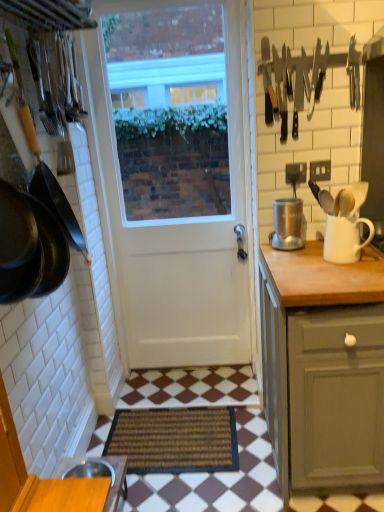
Question: Considering the relative positions of wooden table at lower left and silver metallic coffee grinder at right in the image provided, is wooden table at lower left to the right of silver metallic coffee grinder at right from the viewer's perspective?

Choices:
 (A) no
 (B) yes

Answer: (A)

Question: Would you say silver metallic coffee grinder at right is part of wooden table at lower left's contents?

Choices:
 (A) no
 (B) yes

Answer: (A)

Question: Considering the relative sizes of wooden table at lower left and silver metallic coffee grinder at right in the image provided, is wooden table at lower left wider than silver metallic coffee grinder at right?

Choices:
 (A) no
 (B) yes

Answer: (B)

Question: Is wooden table at lower left bigger than silver metallic coffee grinder at right?

Choices:
 (A) no
 (B) yes

Answer: (B)

Question: Does wooden table at lower left have a greater height compared to silver metallic coffee grinder at right?

Choices:
 (A) no
 (B) yes

Answer: (A)

Question: Is point (274, 204) positioned closer to the camera than point (342, 224)?

Choices:
 (A) closer
 (B) farther

Answer: (B)

Question: Considering the positions of silver metallic coffee grinder at right and white glossy jug at right in the image, is silver metallic coffee grinder at right taller or shorter than white glossy jug at right?

Choices:
 (A) tall
 (B) short

Answer: (A)

Question: Is silver metallic coffee grinder at right wider or thinner than white glossy jug at right?

Choices:
 (A) thin
 (B) wide

Answer: (A)

Question: Which is correct: silver metallic coffee grinder at right is inside white glossy jug at right, or outside of it?

Choices:
 (A) outside
 (B) inside

Answer: (A)

Question: Relative to silver metallic coffee grinder at right, is white matte door at center in front or behind?

Choices:
 (A) front
 (B) behind

Answer: (B)

Question: Which is correct: white matte door at center is inside silver metallic coffee grinder at right, or outside of it?

Choices:
 (A) inside
 (B) outside

Answer: (B)

Question: In terms of width, does white matte door at center look wider or thinner when compared to silver metallic coffee grinder at right?

Choices:
 (A) wide
 (B) thin

Answer: (B)

Question: From the image's perspective, relative to silver metallic coffee grinder at right, is white matte door at center above or below?

Choices:
 (A) below
 (B) above

Answer: (B)

Question: Is white glossy jug at right to the left or to the right of white matte door at center in the image?

Choices:
 (A) right
 (B) left

Answer: (A)

Question: Considering the positions of point (352, 260) and point (145, 300), is point (352, 260) closer or farther from the camera than point (145, 300)?

Choices:
 (A) farther
 (B) closer

Answer: (B)